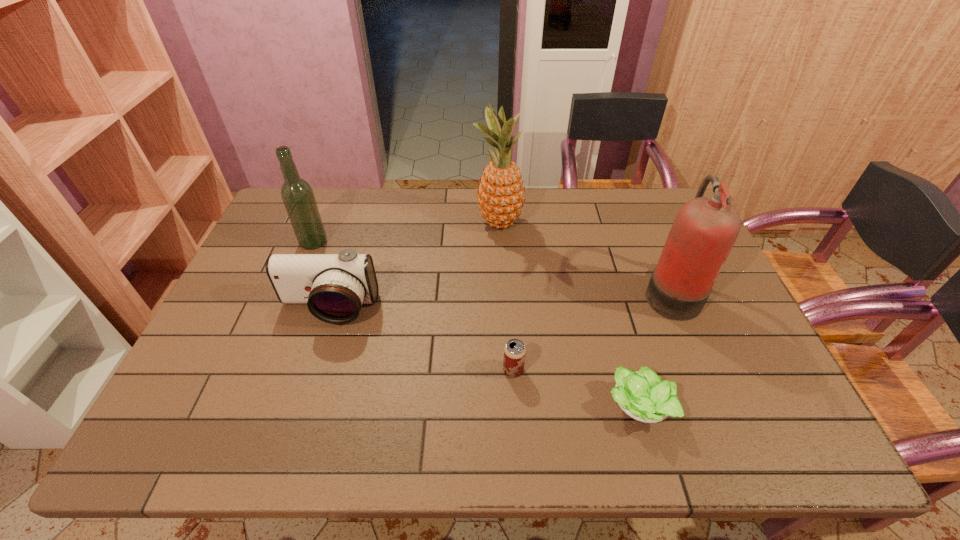
What are the coordinates of `free space between the fourth tallest object and the nearest object` in the screenshot? It's located at (483, 358).

I want to click on vacant region between the fifth tallest object and the third tallest object, so click(414, 306).

The height and width of the screenshot is (540, 960). I want to click on free space between the fifth object from left to right and the third tallest object, so click(x=475, y=325).

What are the coordinates of `vacant space that's between the fourth tallest object and the rightmost object` in the screenshot? It's located at (499, 300).

The width and height of the screenshot is (960, 540). Identify the location of object that is the fifth closest to the fifth farthest object. (297, 195).

Image resolution: width=960 pixels, height=540 pixels. In order to click on the second closest object relative to the fourth shortest object in this screenshot , I will do pyautogui.click(x=500, y=196).

Where is `vacant area that satisfies the following two spatial constraints: 1. on the back side of the third tallest object; 2. on the left side of the pineapple`? vacant area that satisfies the following two spatial constraints: 1. on the back side of the third tallest object; 2. on the left side of the pineapple is located at coordinates (322, 222).

The height and width of the screenshot is (540, 960). What are the coordinates of `free space in the image that satisfies the following two spatial constraints: 1. at the nozzle of the rightmost object; 2. on the front side of the second nearest object` in the screenshot? It's located at (703, 370).

In order to click on vacant area in the image that satisfies the following two spatial constraints: 1. at the nozzle of the fire extinguisher; 2. on the surface of the fourth tallest object in this screenshot , I will do `click(677, 309)`.

The height and width of the screenshot is (540, 960). I want to click on vacant point that satisfies the following two spatial constraints: 1. at the nozzle of the fire extinguisher; 2. on the surface of the third shortest object, so [x=677, y=309].